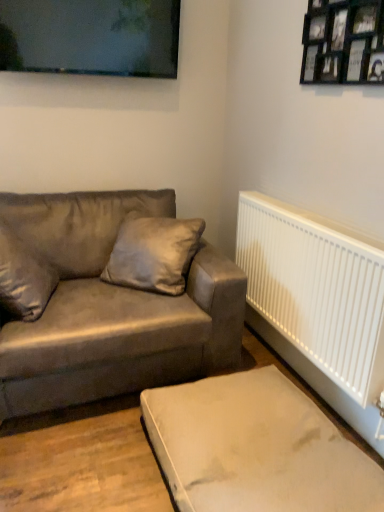
Locate an element on the screen. The width and height of the screenshot is (384, 512). beige fabric ottoman at lower right is located at coordinates (255, 448).

At what (x,y) coordinates should I click in order to perform the action: click on suede-like beige pillow at center. Please return your answer as a coordinate pair (x, y). This screenshot has width=384, height=512. Looking at the image, I should click on (153, 253).

The height and width of the screenshot is (512, 384). Find the location of `suede-like brown couch at left`. suede-like brown couch at left is located at coordinates (110, 308).

Which object is positioned more to the right, suede-like beige pillow at center or beige fabric ottoman at lower right?

From the viewer's perspective, beige fabric ottoman at lower right appears more on the right side.

Considering the relative positions of suede-like beige pillow at center and beige fabric ottoman at lower right in the image provided, is suede-like beige pillow at center behind beige fabric ottoman at lower right?

Yes, it is behind beige fabric ottoman at lower right.

Between point (148, 266) and point (227, 439), which one is positioned behind?

The point (148, 266) is more distant.

Is suede-like beige pillow at center oriented away from beige fabric ottoman at lower right?

No, suede-like beige pillow at center's orientation is not away from beige fabric ottoman at lower right.

From the image's perspective, which object appears higher, beige fabric ottoman at lower right or black wooden picture frame at upper right, the second picture frame when ordered from left to right?

black wooden picture frame at upper right, the second picture frame when ordered from left to right, is shown above in the image.

Who is more distant, beige fabric ottoman at lower right or black wooden picture frame at upper right, the second picture frame when ordered from left to right?

black wooden picture frame at upper right, the second picture frame when ordered from left to right, is further away from the camera.

Does point (212, 497) come behind point (354, 71)?

No, (212, 497) is in front of (354, 71).

Considering the sizes of objects beige fabric ottoman at lower right and black wooden picture frame at upper right, which ranks as the 1th picture frame in right-to-left order, in the image provided, who is shorter, beige fabric ottoman at lower right or black wooden picture frame at upper right, which ranks as the 1th picture frame in right-to-left order,?

Standing shorter between the two is beige fabric ottoman at lower right.

Could you measure the distance between suede-like brown couch at left and black wooden picture frame at upper right, positioned as the 2th picture frame in back-to-front order?

suede-like brown couch at left is 1.21 meters away from black wooden picture frame at upper right, positioned as the 2th picture frame in back-to-front order.

Can you see suede-like brown couch at left touching black wooden picture frame at upper right, the second picture frame when ordered from left to right?

No, suede-like brown couch at left is not beside black wooden picture frame at upper right, the second picture frame when ordered from left to right.

Find the location of a particular element. This screenshot has height=512, width=384. studio couch that appears below the black wooden picture frame at upper right, the second picture frame when ordered from left to right (from the image's perspective) is located at coordinates (110, 308).

Between suede-like beige pillow at center and suede-like brown couch at left, which one has larger width?

suede-like brown couch at left.

Is suede-like beige pillow at center facing towards suede-like brown couch at left?

Yes, suede-like beige pillow at center is turned towards suede-like brown couch at left.

Which of these two, suede-like beige pillow at center or suede-like brown couch at left, is bigger?

suede-like brown couch at left.

This screenshot has height=512, width=384. Find the location of `studio couch that is on the right side of matte black picture frame at upper center, acting as the 1th picture frame starting from the back`. studio couch that is on the right side of matte black picture frame at upper center, acting as the 1th picture frame starting from the back is located at coordinates (110, 308).

Is suede-like brown couch at left surrounded by matte black picture frame at upper center, acting as the 1th picture frame starting from the back?

No, matte black picture frame at upper center, acting as the 1th picture frame starting from the back, does not contain suede-like brown couch at left.

Is matte black picture frame at upper center, the 1th picture frame when ordered from left to right, bigger or smaller than suede-like brown couch at left?

Considering their sizes, matte black picture frame at upper center, the 1th picture frame when ordered from left to right, takes up less space than suede-like brown couch at left.

Can you confirm if matte black picture frame at upper center, arranged as the 2th picture frame when viewed from the right, is thinner than suede-like brown couch at left?

Yes, matte black picture frame at upper center, arranged as the 2th picture frame when viewed from the right, is thinner than suede-like brown couch at left.

Can you confirm if black wooden picture frame at upper right, positioned as the 2th picture frame in back-to-front order, is wider than suede-like beige pillow at center?

No.

Is the position of black wooden picture frame at upper right, which appears as the 1th picture frame when viewed from the front, more distant than that of suede-like beige pillow at center?

That is False.

How different are the orientations of black wooden picture frame at upper right, which appears as the 1th picture frame when viewed from the front, and suede-like beige pillow at center in degrees?

The facing directions of black wooden picture frame at upper right, which appears as the 1th picture frame when viewed from the front, and suede-like beige pillow at center are 42.7 degrees apart.

Choose the correct answer: Is black wooden picture frame at upper right, the second picture frame when ordered from left to right, inside suede-like beige pillow at center or outside it?

black wooden picture frame at upper right, the second picture frame when ordered from left to right, is spatially situated outside suede-like beige pillow at center.

Which is in front, point (148, 288) or point (126, 17)?

The point (148, 288) is closer to the camera.

Is suede-like beige pillow at center with matte black picture frame at upper center, arranged as the 2th picture frame when viewed from the right?

suede-like beige pillow at center and matte black picture frame at upper center, arranged as the 2th picture frame when viewed from the right, are clearly separated.

Consider the image. Considering the relative sizes of suede-like beige pillow at center and matte black picture frame at upper center, which is the 2th picture frame in front-to-back order, in the image provided, is suede-like beige pillow at center shorter than matte black picture frame at upper center, which is the 2th picture frame in front-to-back order,?

Incorrect, the height of suede-like beige pillow at center does not fall short of that of matte black picture frame at upper center, which is the 2th picture frame in front-to-back order.

Consider the image. Which object is closer to the camera taking this photo, suede-like beige pillow at center or matte black picture frame at upper center, arranged as the 2th picture frame when viewed from the right?

suede-like beige pillow at center is more forward.

The height and width of the screenshot is (512, 384). I want to click on furniture in front of the suede-like beige pillow at center, so click(255, 448).

From the image's perspective, count 1st picture frames upward from the beige fabric ottoman at lower right and point to it. Please provide its 2D coordinates.

[(343, 42)]

Looking at the image, which one is located further to suede-like beige pillow at center, black wooden picture frame at upper right, the second picture frame when ordered from left to right, or beige fabric ottoman at lower right?

Based on the image, black wooden picture frame at upper right, the second picture frame when ordered from left to right, appears to be further to suede-like beige pillow at center.

Which object lies further to the anchor point suede-like beige pillow at center, matte black picture frame at upper center, the 1th picture frame when ordered from left to right, or suede-like brown couch at left?

Based on the image, matte black picture frame at upper center, the 1th picture frame when ordered from left to right, appears to be further to suede-like beige pillow at center.

From the image, which object appears to be farther from suede-like beige pillow at center, black wooden picture frame at upper right, which ranks as the 1th picture frame in right-to-left order, or suede-like brown couch at left?

black wooden picture frame at upper right, which ranks as the 1th picture frame in right-to-left order, is further to suede-like beige pillow at center.

Which object lies further to the anchor point black wooden picture frame at upper right, which appears as the 1th picture frame when viewed from the front, matte black picture frame at upper center, the 1th picture frame when ordered from left to right, or beige fabric ottoman at lower right?

Based on the image, beige fabric ottoman at lower right appears to be further to black wooden picture frame at upper right, which appears as the 1th picture frame when viewed from the front.

Looking at the image, which one is located further to suede-like brown couch at left, black wooden picture frame at upper right, the second picture frame when ordered from left to right, or matte black picture frame at upper center, acting as the 1th picture frame starting from the back?

black wooden picture frame at upper right, the second picture frame when ordered from left to right, lies further to suede-like brown couch at left than the other object.

Estimate the real-world distances between objects in this image. Which object is further from black wooden picture frame at upper right, the second picture frame when ordered from left to right, suede-like beige pillow at center or matte black picture frame at upper center, the 1th picture frame when ordered from left to right?

Based on the image, suede-like beige pillow at center appears to be further to black wooden picture frame at upper right, the second picture frame when ordered from left to right.

Based on the photo, considering their positions, is suede-like brown couch at left positioned further to suede-like beige pillow at center than matte black picture frame at upper center, the 1th picture frame when ordered from left to right?

The object further to suede-like beige pillow at center is matte black picture frame at upper center, the 1th picture frame when ordered from left to right.

Looking at the image, which one is located further to suede-like brown couch at left, suede-like beige pillow at center or black wooden picture frame at upper right, which appears as the 1th picture frame when viewed from the front?

black wooden picture frame at upper right, which appears as the 1th picture frame when viewed from the front, is further to suede-like brown couch at left.

You are a GUI agent. You are given a task and a screenshot of the screen. Output one action in this format:
    pyautogui.click(x=<x>, y=<y>)
    Task: Click on the picture frame between matte black picture frame at upper center, acting as the 1th picture frame starting from the back, and suede-like beige pillow at center in the up-down direction
    This screenshot has height=512, width=384.
    Given the screenshot: What is the action you would take?
    pyautogui.click(x=343, y=42)

Locate an element on the screen. The height and width of the screenshot is (512, 384). pillow between black wooden picture frame at upper right, which ranks as the 1th picture frame in right-to-left order, and beige fabric ottoman at lower right, in the vertical direction is located at coordinates (153, 253).

The height and width of the screenshot is (512, 384). Identify the location of picture frame between matte black picture frame at upper center, acting as the 1th picture frame starting from the back, and beige fabric ottoman at lower right vertically. (343, 42).

Identify the location of studio couch that lies between black wooden picture frame at upper right, the second picture frame when ordered from left to right, and beige fabric ottoman at lower right from top to bottom. The height and width of the screenshot is (512, 384). (110, 308).